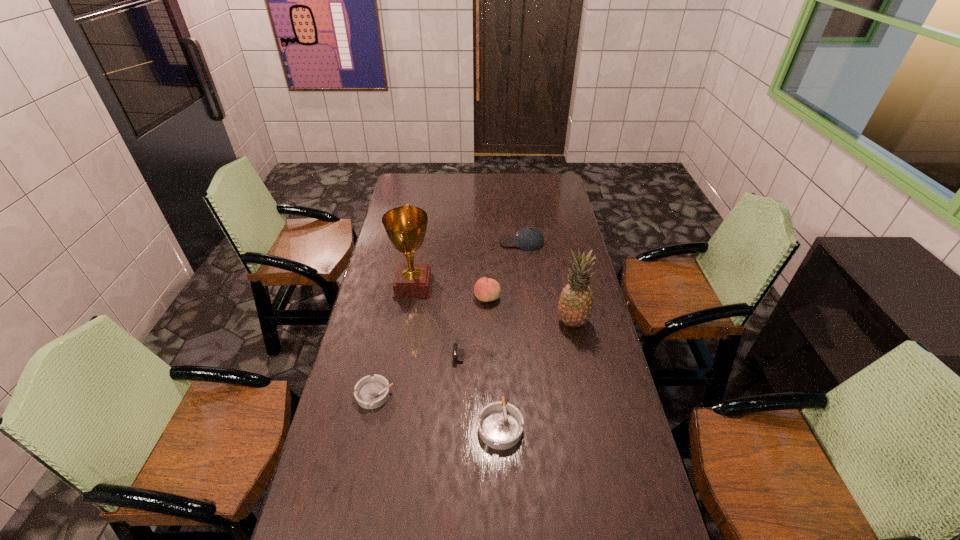
This screenshot has height=540, width=960. Find the location of `ashtray that is at the left edge`. ashtray that is at the left edge is located at coordinates (370, 392).

You are a GUI agent. You are given a task and a screenshot of the screen. Output one action in this format:
    pyautogui.click(x=<x>, y=<y>)
    Task: Click on the award located at the left edge
    
    Given the screenshot: What is the action you would take?
    pyautogui.click(x=405, y=226)

In order to click on baseball cap at the right edge in this screenshot , I will do `click(528, 238)`.

Locate an element on the screen. pineapple at the right edge is located at coordinates (575, 306).

Locate an element on the screen. The width and height of the screenshot is (960, 540). free space at the left edge of the desktop is located at coordinates (350, 460).

Identify the location of vacant region at the right edge of the desktop. (621, 407).

Where is `vacant space at the near left corner of the desktop`? The width and height of the screenshot is (960, 540). vacant space at the near left corner of the desktop is located at coordinates (x=360, y=527).

Identify the location of free space between the award and the shorter ashtray. (395, 340).

Find the location of a particular element. The width and height of the screenshot is (960, 540). free space between the award and the fourth nearest object is located at coordinates (492, 304).

This screenshot has width=960, height=540. In order to click on free space between the fifth shortest object and the baseball cap in this screenshot , I will do `click(504, 270)`.